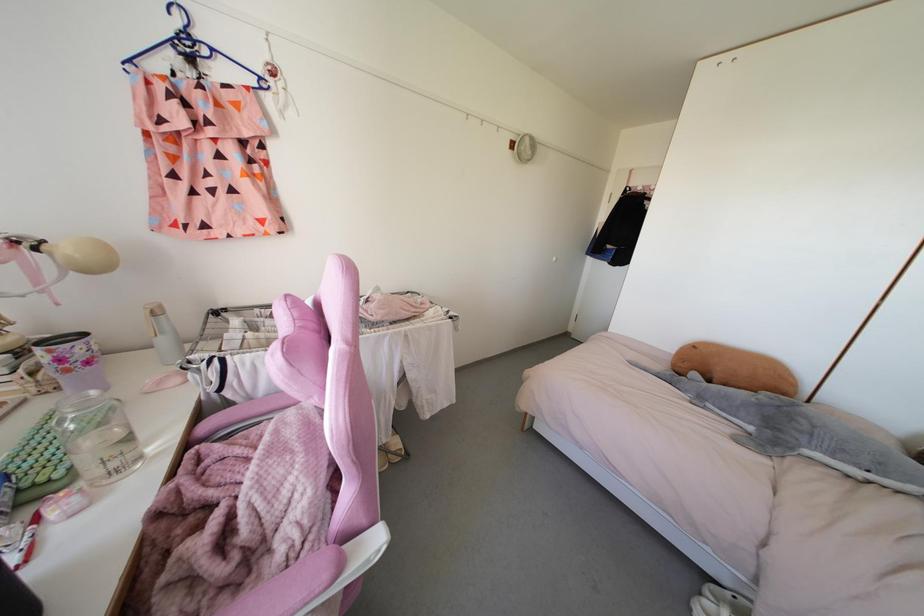
Find the location of a particular element. pink chair sitting surface is located at coordinates (239, 522).